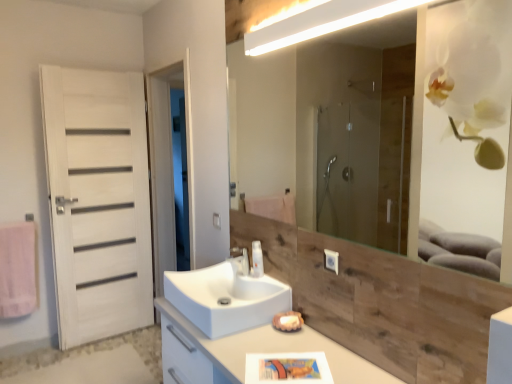
Question: Is white glossy sink at center with white glossy cabinet at center?

Choices:
 (A) yes
 (B) no

Answer: (B)

Question: Is the depth of white glossy sink at center greater than that of white glossy cabinet at center?

Choices:
 (A) yes
 (B) no

Answer: (A)

Question: Is white glossy sink at center completely or partially outside of white glossy cabinet at center?

Choices:
 (A) yes
 (B) no

Answer: (A)

Question: From a real-world perspective, is white glossy sink at center positioned under white glossy cabinet at center based on gravity?

Choices:
 (A) yes
 (B) no

Answer: (B)

Question: Is white glossy sink at center wider than white glossy cabinet at center?

Choices:
 (A) no
 (B) yes

Answer: (A)

Question: Is white glossy sink at center to the right of white glossy cabinet at center from the viewer's perspective?

Choices:
 (A) yes
 (B) no

Answer: (B)

Question: Does white glossy light fixture at upper center lie in front of white wood door at left?

Choices:
 (A) no
 (B) yes

Answer: (B)

Question: Is white glossy light fixture at upper center thinner than white wood door at left?

Choices:
 (A) no
 (B) yes

Answer: (B)

Question: Does white glossy light fixture at upper center appear on the right side of white wood door at left?

Choices:
 (A) yes
 (B) no

Answer: (A)

Question: Is white glossy light fixture at upper center outside of white wood door at left?

Choices:
 (A) yes
 (B) no

Answer: (A)

Question: From a real-world perspective, is white glossy light fixture at upper center on white wood door at left?

Choices:
 (A) yes
 (B) no

Answer: (A)

Question: Is white glossy light fixture at upper center to the left of white wood door at left from the viewer's perspective?

Choices:
 (A) no
 (B) yes

Answer: (A)

Question: Is white glossy light fixture at upper center to the right of white matte door at left from the viewer's perspective?

Choices:
 (A) yes
 (B) no

Answer: (A)